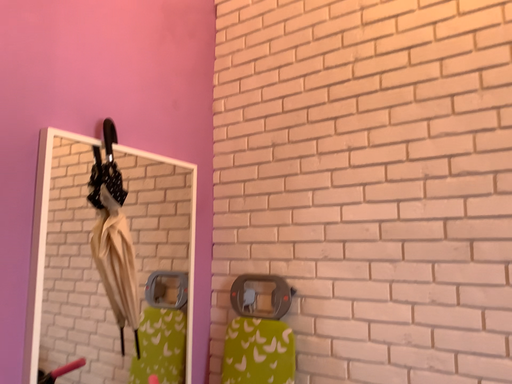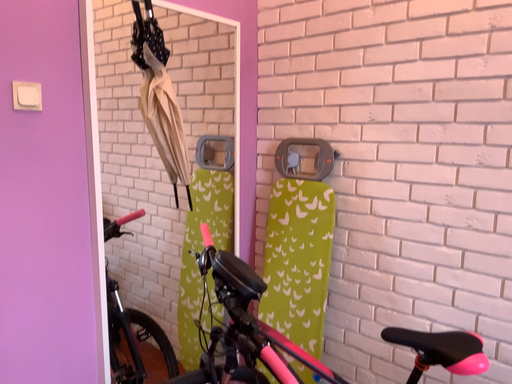
Question: How did the camera likely rotate when shooting the video?

Choices:
 (A) rotated downward
 (B) rotated upward

Answer: (A)